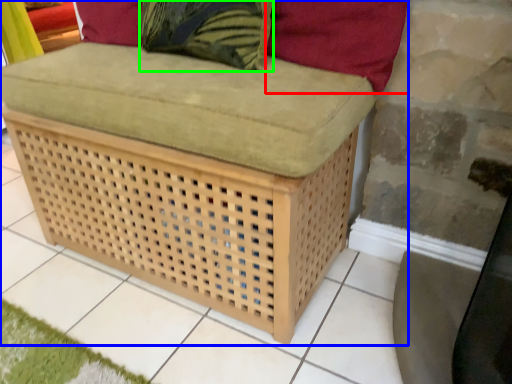
Question: Estimate the real-world distances between objects in this image. Which object is farther from pillow (highlighted by a red box), furniture (highlighted by a blue box) or throw pillow (highlighted by a green box)?

Choices:
 (A) furniture
 (B) throw pillow

Answer: (A)